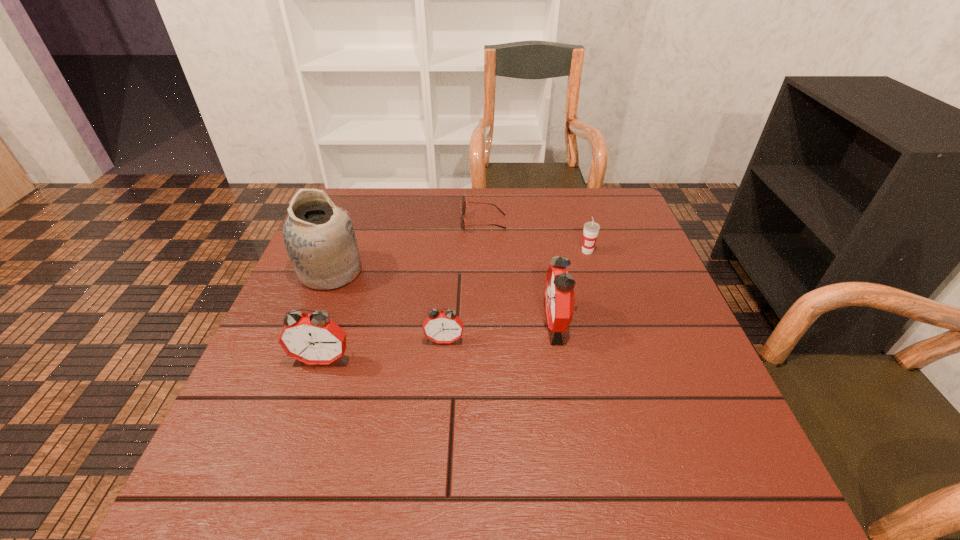
Please point a free position for a alarm clock on the right. Please provide its 2D coordinates. Your answer should be formatted as a tuple, i.e. [(x, y)], where the tuple contains the x and y coordinates of a point satisfying the conditions above.

[(661, 307)]